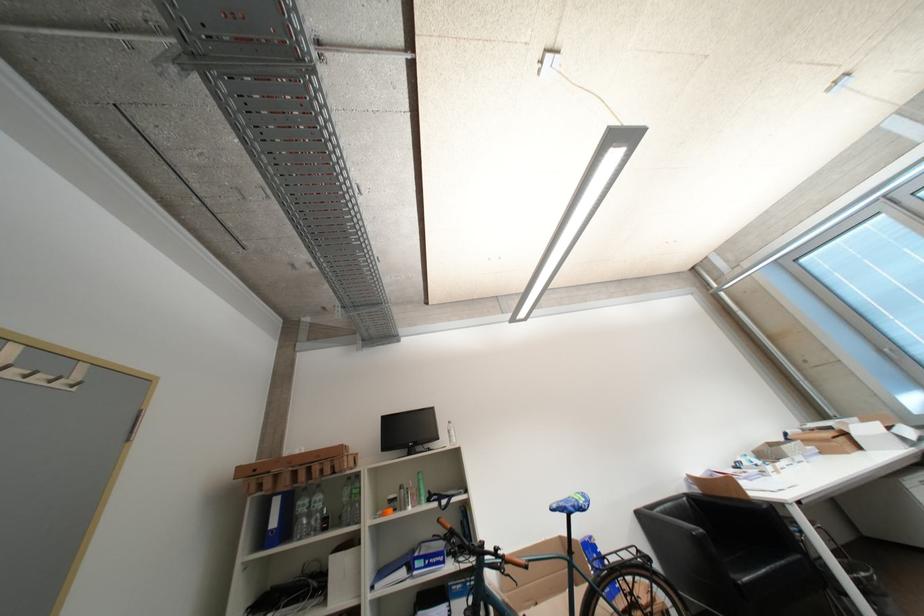
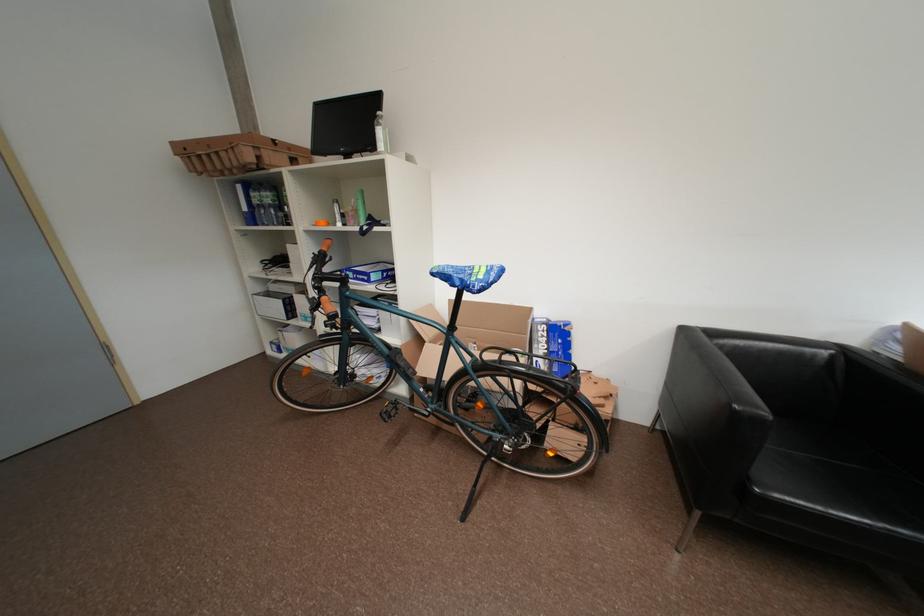
In the second image, find the point that corresponds to point (427, 492) in the first image.

(363, 213)